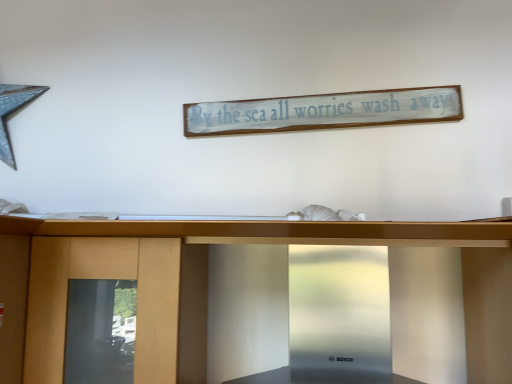
Question: Is white distressed wood signboard at upper center spatially inside stainless steel range hood at center, or outside of it?

Choices:
 (A) inside
 (B) outside

Answer: (B)

Question: From the image's perspective, is white distressed wood signboard at upper center positioned above or below stainless steel range hood at center?

Choices:
 (A) above
 (B) below

Answer: (A)

Question: In terms of size, does white distressed wood signboard at upper center appear bigger or smaller than stainless steel range hood at center?

Choices:
 (A) small
 (B) big

Answer: (A)

Question: Is stainless steel range hood at center taller or shorter than white distressed wood signboard at upper center?

Choices:
 (A) tall
 (B) short

Answer: (A)

Question: Considering the positions of point (307, 235) and point (349, 92), is point (307, 235) closer or farther from the camera than point (349, 92)?

Choices:
 (A) closer
 (B) farther

Answer: (A)

Question: Choose the correct answer: Is stainless steel range hood at center inside white distressed wood signboard at upper center or outside it?

Choices:
 (A) outside
 (B) inside

Answer: (A)

Question: From a real-world perspective, is stainless steel range hood at center physically located above or below white distressed wood signboard at upper center?

Choices:
 (A) above
 (B) below

Answer: (B)